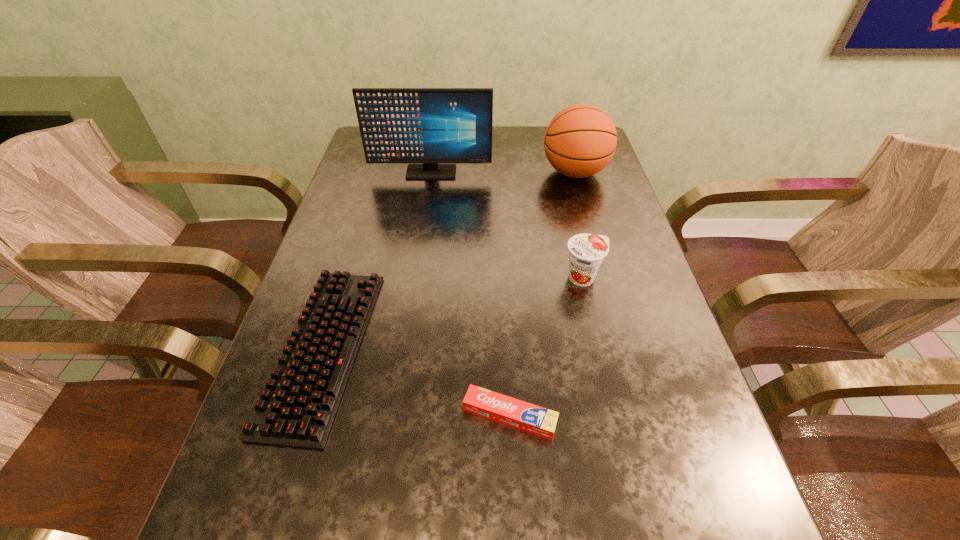
You are a GUI agent. You are given a task and a screenshot of the screen. Output one action in this format:
    pyautogui.click(x=<x>, y=<y>)
    Task: Click on the object situated at the far edge
    
    Given the screenshot: What is the action you would take?
    pyautogui.click(x=580, y=141)

At what (x,y) coordinates should I click in order to perform the action: click on computer monitor that is positioned at the left edge. Please return your answer as a coordinate pair (x, y). Looking at the image, I should click on (398, 125).

The height and width of the screenshot is (540, 960). Find the location of `computer keyboard positioned at the left edge`. computer keyboard positioned at the left edge is located at coordinates (297, 407).

Where is `basketball that is positioned at the right edge`? Image resolution: width=960 pixels, height=540 pixels. basketball that is positioned at the right edge is located at coordinates (580, 141).

The width and height of the screenshot is (960, 540). Find the location of `yogurt that is at the right edge`. yogurt that is at the right edge is located at coordinates (586, 251).

At what (x,y) coordinates should I click in order to perform the action: click on object located in the far right corner section of the desktop. Please return your answer as a coordinate pair (x, y). Looking at the image, I should click on (580, 141).

This screenshot has width=960, height=540. In order to click on free space at the far edge of the desktop in this screenshot , I will do `click(534, 141)`.

At what (x,y) coordinates should I click in order to perform the action: click on vacant space at the left edge of the desktop. Please return your answer as a coordinate pair (x, y). Looking at the image, I should click on (357, 178).

At what (x,y) coordinates should I click in order to perform the action: click on vacant point at the right edge. Please return your answer as a coordinate pair (x, y). This screenshot has width=960, height=540. Looking at the image, I should click on (569, 186).

Locate an element on the screen. unoccupied area between the yogurt and the computer keyboard is located at coordinates (453, 313).